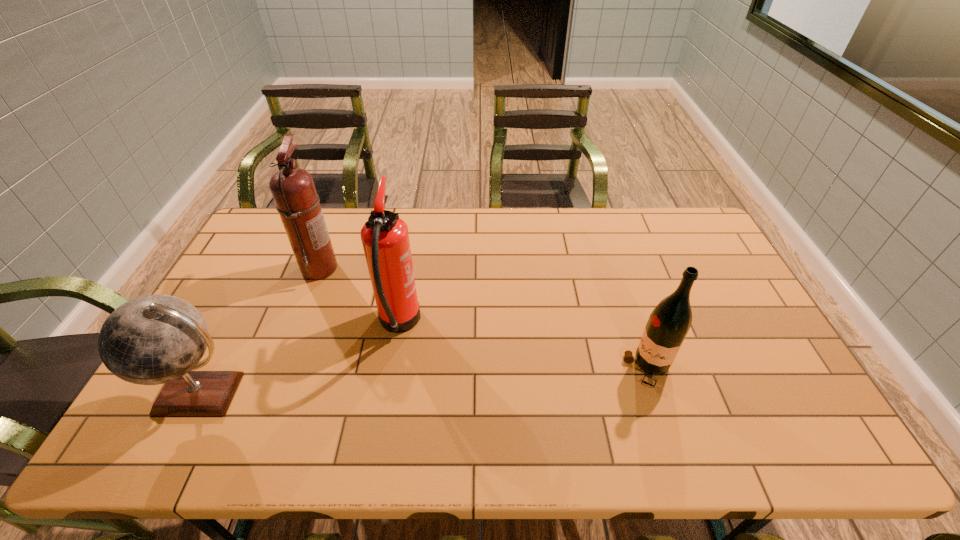
You are a GUI agent. You are given a task and a screenshot of the screen. Output one action in this format:
    pyautogui.click(x=<x>, y=<y>)
    Task: Click on the free space that satisfies the following two spatial constraints: 1. at the nozzle of the nearer fire extinguisher; 2. at the equator of the globe
    
    Given the screenshot: What is the action you would take?
    387,393

Locate an element on the screen. This screenshot has height=540, width=960. free location that satisfies the following two spatial constraints: 1. at the nozzle of the second object from right to left; 2. on the left side of the rightmost object is located at coordinates click(x=392, y=369).